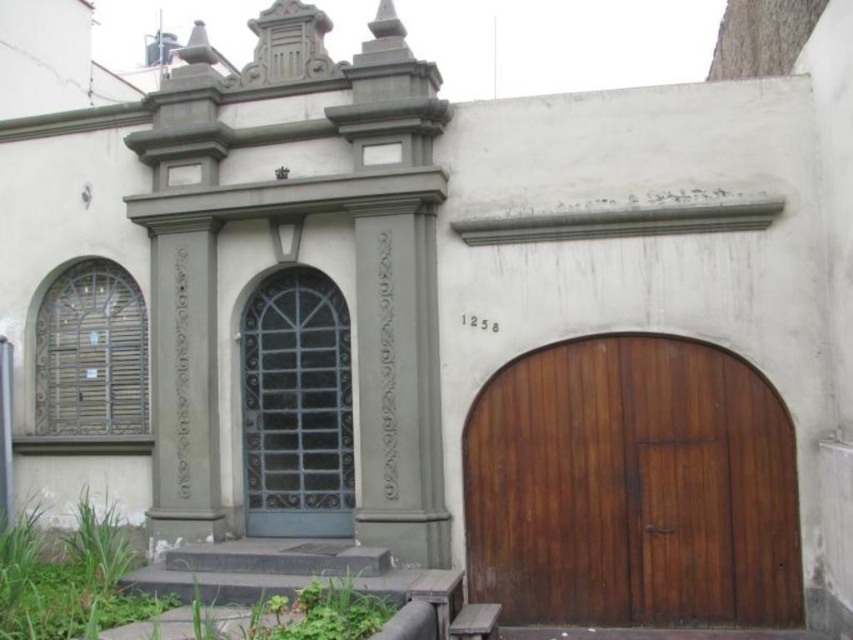
This screenshot has height=640, width=853. Describe the element at coordinates (631, 486) in the screenshot. I see `dark brown wood garage door at center` at that location.

Does dark brown wood garage door at center have a larger size compared to matte gray door at center?

Yes.

Describe the element at coordinates (631, 486) in the screenshot. I see `dark brown wood garage door at center` at that location.

Find the location of `dark brown wood garage door at center`. dark brown wood garage door at center is located at coordinates (631, 486).